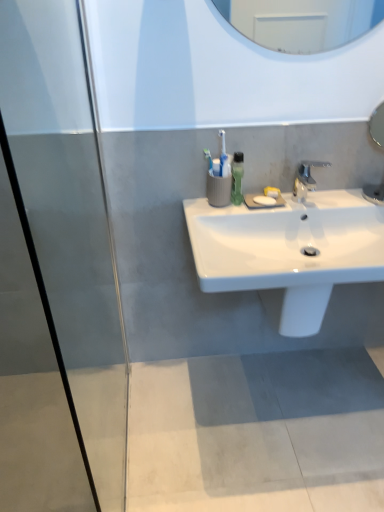
This screenshot has width=384, height=512. What are the coordinates of `free spot to the right of silver metallic faucet at center` in the screenshot? It's located at (353, 199).